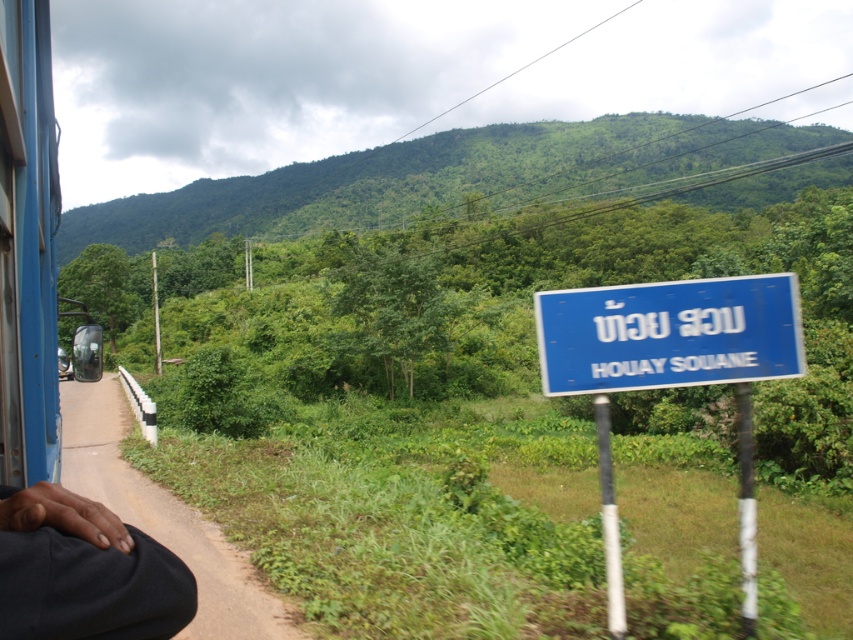
Who is more forward, (x=564, y=291) or (x=596, y=378)?

Point (x=596, y=378)

Is point (714, 333) farther from viewer compared to point (590, 356)?

Yes, it is behind point (590, 356).

Between point (798, 342) and point (712, 307), which one is positioned in front?

Point (712, 307)

At what (x,y) coordinates should I click in order to perform the action: click on blue plastic sign at center. Please return your answer as a coordinate pair (x, y). Looking at the image, I should click on (671, 371).

Between point (791, 337) and point (103, 516), which one is positioned behind?

The point (791, 337) is more distant.

Is blue plastic sign at center positioned at the back of dark blue fabric at lower left?

Yes.

Where is `blue plastic sign at center`? The image size is (853, 640). blue plastic sign at center is located at coordinates (671, 371).

Does blue plastic sign at center-right appear over dark blue fabric at lower left?

Yes, blue plastic sign at center-right is above dark blue fabric at lower left.

Is blue plastic sign at center-right thinner than dark blue fabric at lower left?

Incorrect, blue plastic sign at center-right's width is not less than dark blue fabric at lower left's.

What do you see at coordinates (669, 333) in the screenshot? This screenshot has width=853, height=640. I see `blue plastic sign at center-right` at bounding box center [669, 333].

You are a GUI agent. You are given a task and a screenshot of the screen. Output one action in this format:
    pyautogui.click(x=<x>, y=<y>)
    Task: Click on the blue plastic sign at center-right
    
    Given the screenshot: What is the action you would take?
    pyautogui.click(x=669, y=333)